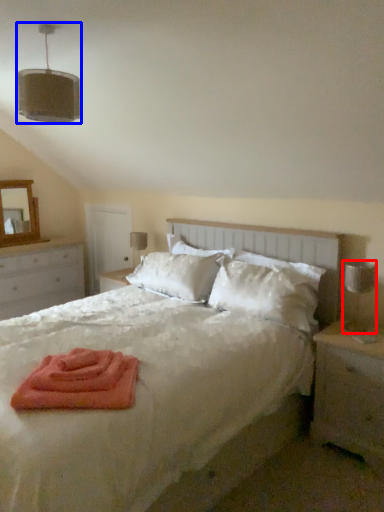
Question: Which object appears closest to the camera in this image, table lamp (highlighted by a red box) or light fixture (highlighted by a blue box)?

Choices:
 (A) table lamp
 (B) light fixture

Answer: (B)